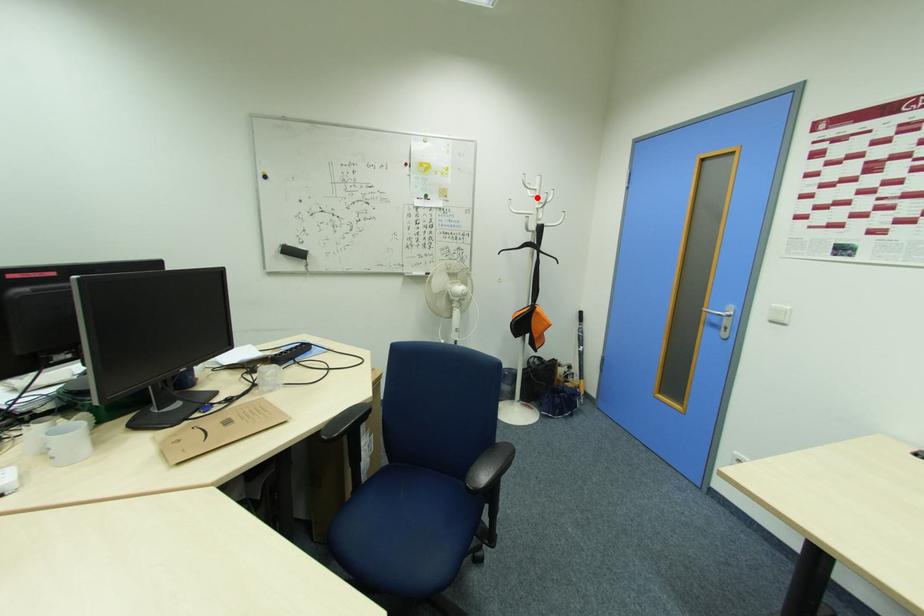
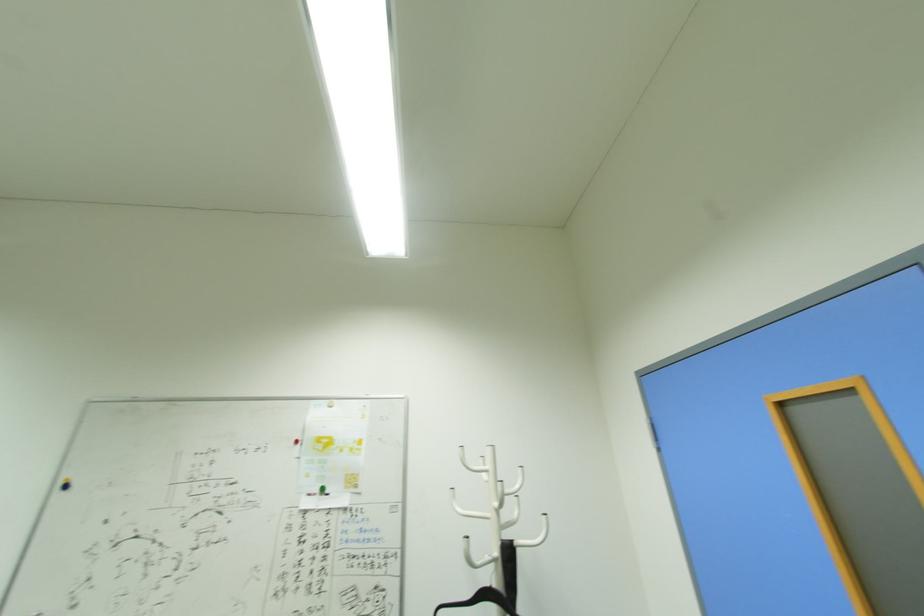
Question: I am providing you with two images of the same scene from different viewpoints. A red point is shown in image1. For the corresponding object point in image2, is it positioned nearer or farther from the camera?

Choices:
 (A) Nearer
 (B) Farther

Answer: (B)